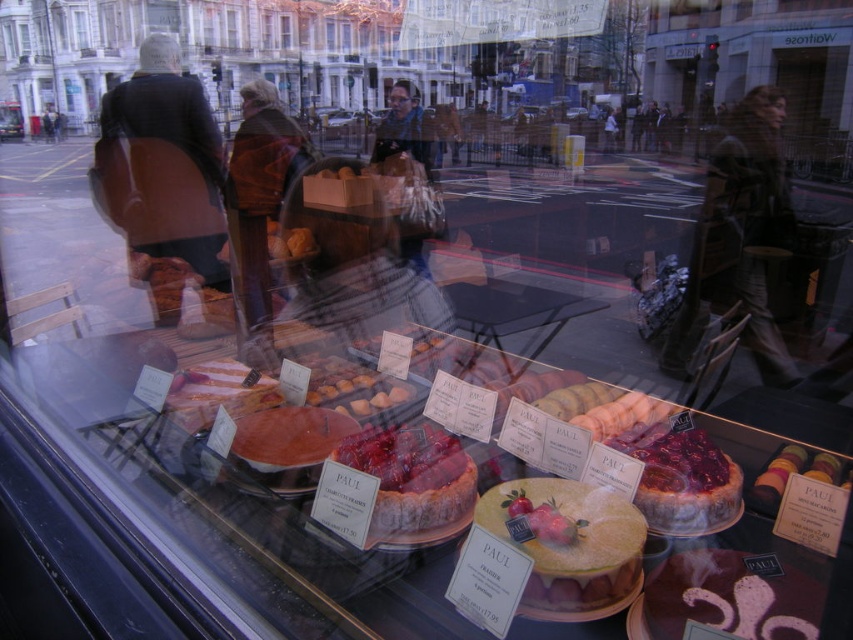
Question: Is dark brown leather jacket at upper left smaller than glazed strawberry tart at center?

Choices:
 (A) no
 (B) yes

Answer: (A)

Question: Is golden sponge cake at center in front of brown wool scarf at center?

Choices:
 (A) yes
 (B) no

Answer: (A)

Question: Is golden sponge cake at center positioned behind multicolored macarons at center?

Choices:
 (A) yes
 (B) no

Answer: (B)

Question: Which point is closer to the camera?

Choices:
 (A) (683, 532)
 (B) (534, 484)
 (C) (141, 140)

Answer: (A)

Question: Among these points, which one is nearest to the camera?

Choices:
 (A) (315, 449)
 (B) (752, 484)

Answer: (B)

Question: Which of the following is the closest to the observer?

Choices:
 (A) [421, 456]
 (B) [650, 465]
 (C) [743, 308]

Answer: (B)